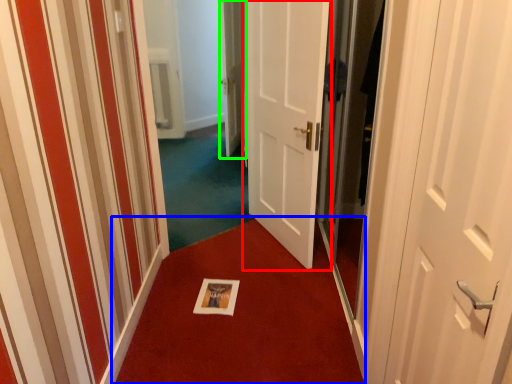
Question: Which object is the closest to the door (highlighted by a red box)? Choose among these: doormat (highlighted by a blue box) or door (highlighted by a green box).

Choices:
 (A) doormat
 (B) door

Answer: (B)